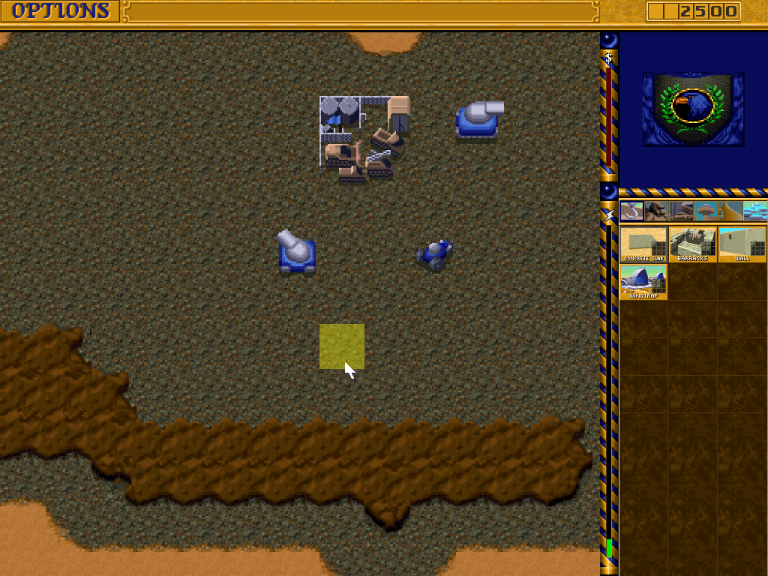
Where is `last row of pictures`? The width and height of the screenshot is (768, 576). last row of pictures is located at coordinates (639, 287).